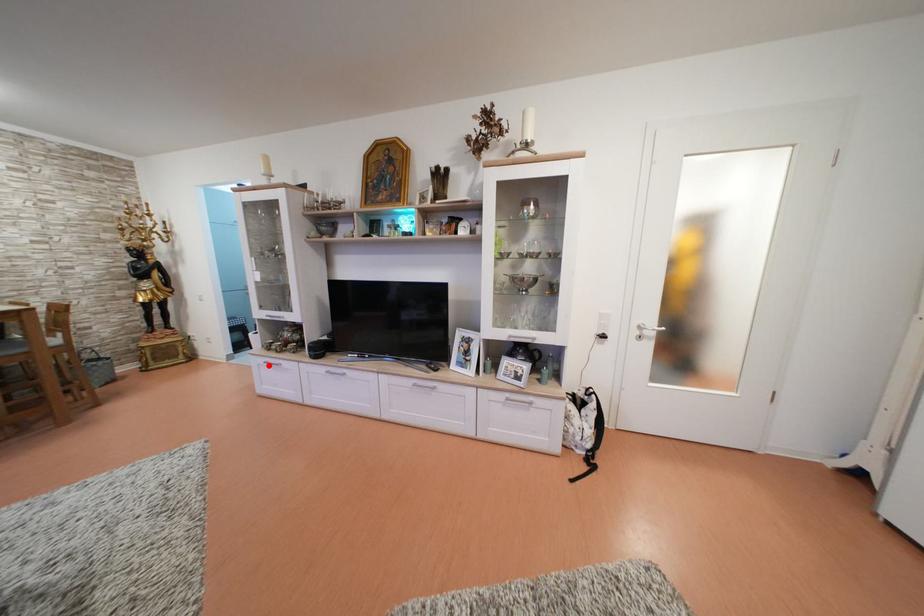
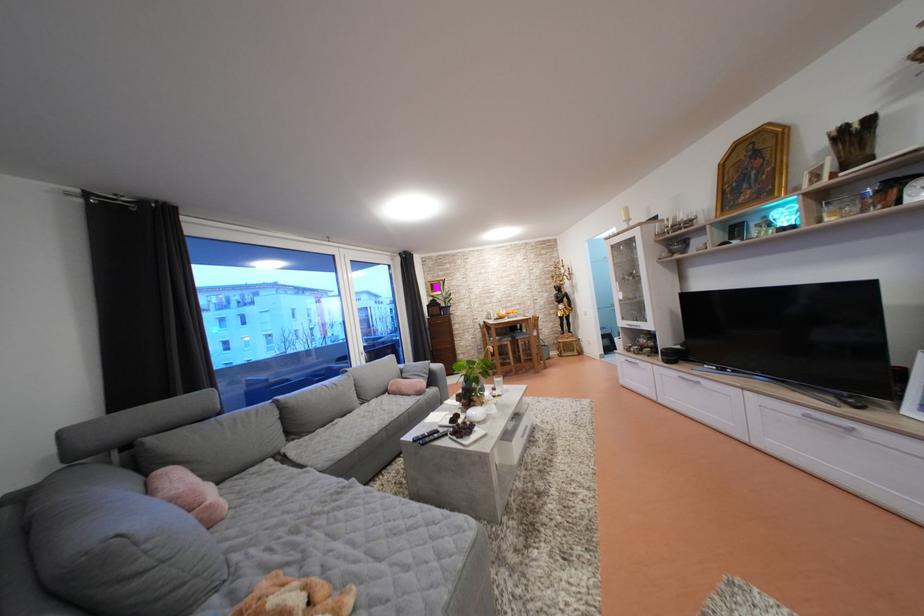
Question: I am providing you with two images of the same scene from different viewpoints. A red point is shown in image1. For the corresponding object point in image2, is it positioned nearer or farther from the camera?

Choices:
 (A) Nearer
 (B) Farther

Answer: (A)